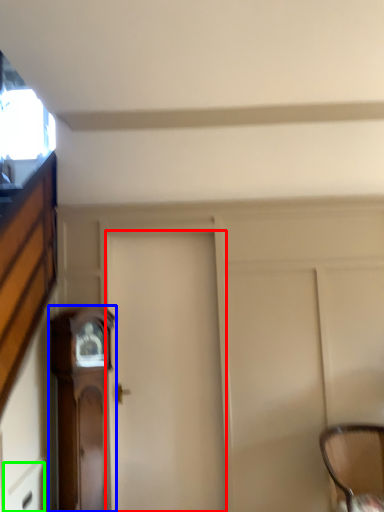
Question: Estimate the real-world distances between objects in this image. Which object is closer to door (highlighted by a red box), furniture (highlighted by a blue box) or drawer (highlighted by a green box)?

Choices:
 (A) furniture
 (B) drawer

Answer: (A)